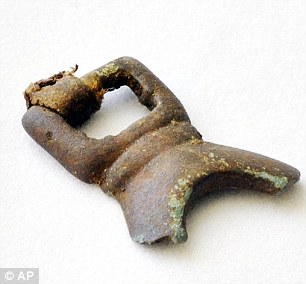
The image size is (306, 284). Identify the location of corner. (22, 117), (126, 57), (88, 178), (183, 112).